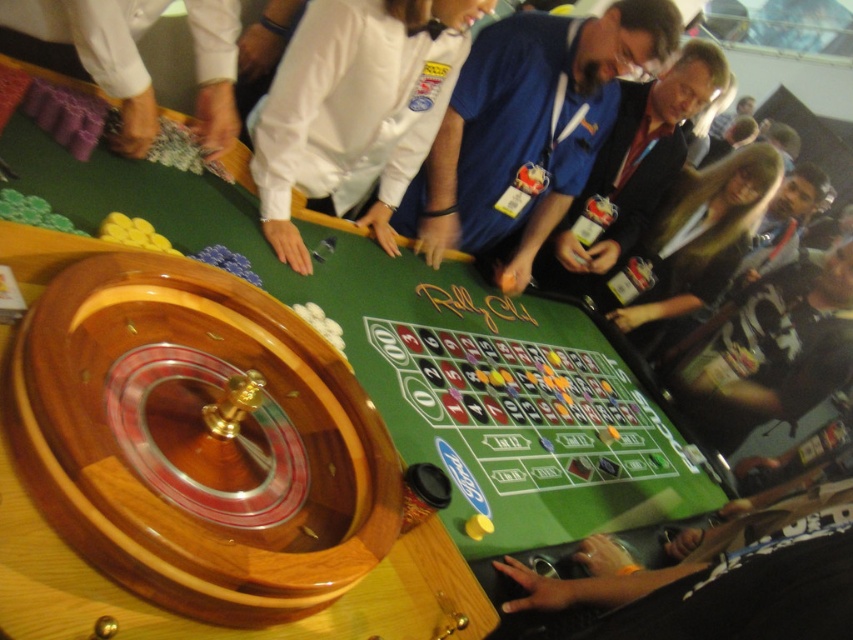
Question: Which object is the farthest from the long brown hair at center?

Choices:
 (A) white fabric at upper left
 (B) dark blue shirt at center

Answer: (A)

Question: Does white shirt at center come behind long brown hair at center?

Choices:
 (A) no
 (B) yes

Answer: (A)

Question: Is blue fabric shirt at center further to camera compared to white shirt at center?

Choices:
 (A) yes
 (B) no

Answer: (A)

Question: Which point is farther to the camera?

Choices:
 (A) (521, 204)
 (B) (743, 152)
 (C) (621, 195)
 (D) (45, 48)

Answer: (B)

Question: Where is blue fabric shirt at center located in relation to dark blue shirt at center in the image?

Choices:
 (A) left
 (B) right

Answer: (A)

Question: Among these objects, which one is farthest from the camera?

Choices:
 (A) white fabric at upper left
 (B) blue fabric shirt at center
 (C) white shirt at center

Answer: (B)